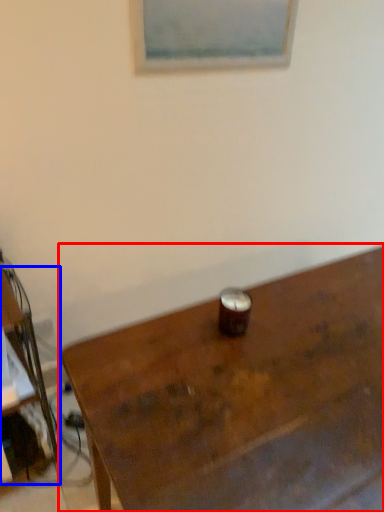
Question: Which object appears closest to the camera in this image, table (highlighted by a red box) or desk (highlighted by a blue box)?

Choices:
 (A) table
 (B) desk

Answer: (A)